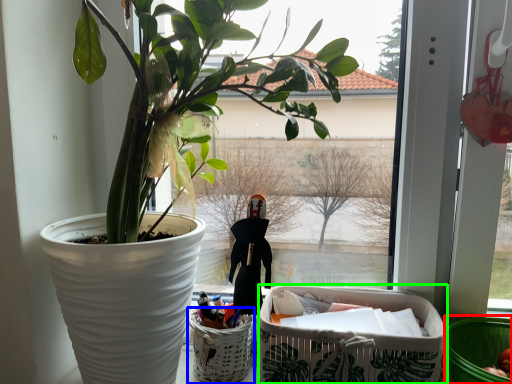
Question: Which object is positioned farthest from basket container (highlighted by a red box)? Select from basket (highlighted by a blue box) and shopping basket (highlighted by a green box).

Choices:
 (A) basket
 (B) shopping basket

Answer: (A)